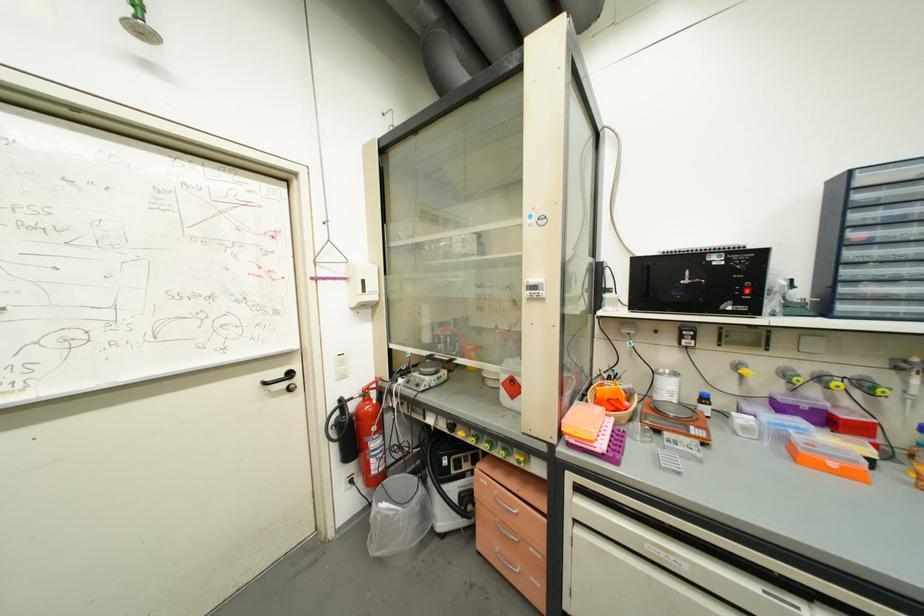
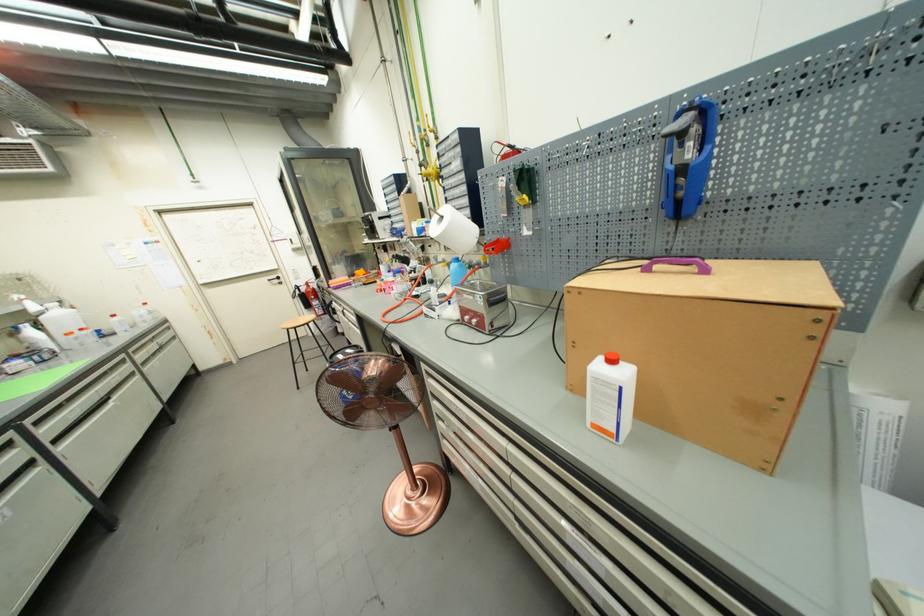
The point at (x=391, y=276) is marked in the first image. Where is the corresponding point in the second image?

(306, 237)